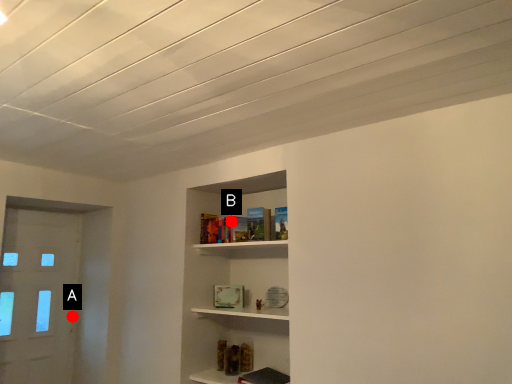
Question: Two points are circled on the image, labeled by A and B beside each circle. Which point is closer to the camera taking this photo?

Choices:
 (A) A is closer
 (B) B is closer

Answer: (B)